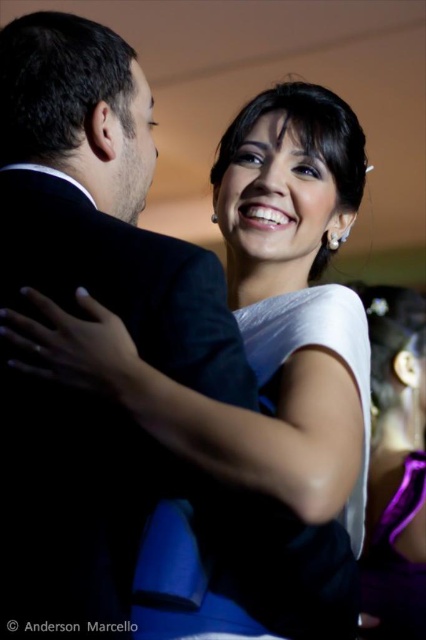
Is point (310, 563) positioned in front of point (394, 605)?

Yes, it is in front of point (394, 605).

Find the location of a particular element. white satin dress at center is located at coordinates (262, 509).

Describe the element at coordinates (101, 200) in the screenshot. Image resolution: width=426 pixels, height=640 pixels. I see `black satin suit at center` at that location.

The image size is (426, 640). I want to click on black satin suit at center, so click(x=101, y=200).

Is point (388, 314) farther from viewer compared to point (406, 477)?

Yes, point (388, 314) is behind point (406, 477).

The image size is (426, 640). Describe the element at coordinates (396, 467) in the screenshot. I see `white satin dress at upper right` at that location.

The width and height of the screenshot is (426, 640). What are the coordinates of `white satin dress at upper right` in the screenshot? It's located at (396, 467).